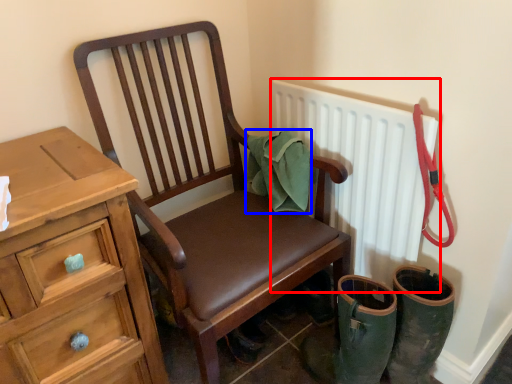
Question: Which object appears closest to the camera in this image, radiator (highlighted by a red box) or material (highlighted by a blue box)?

Choices:
 (A) radiator
 (B) material

Answer: (A)